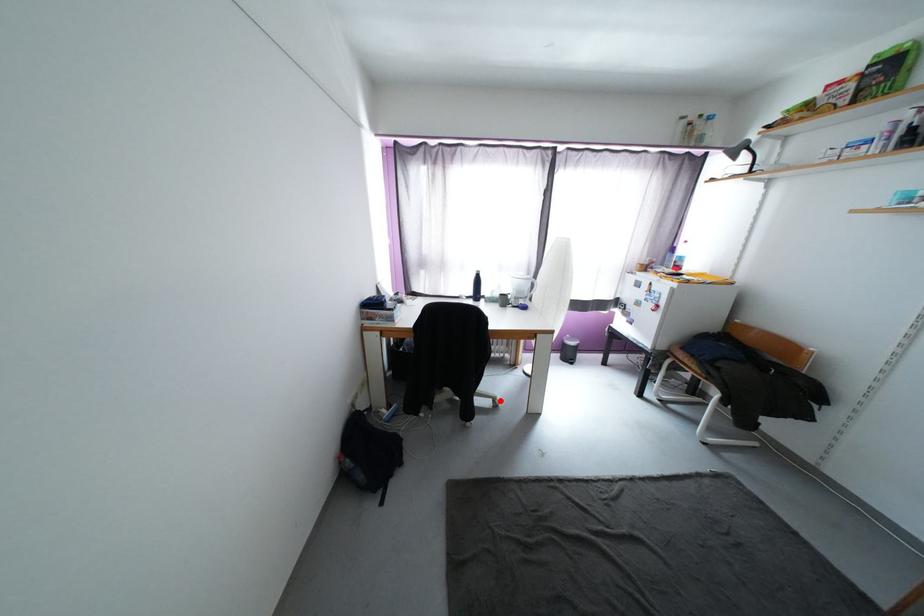
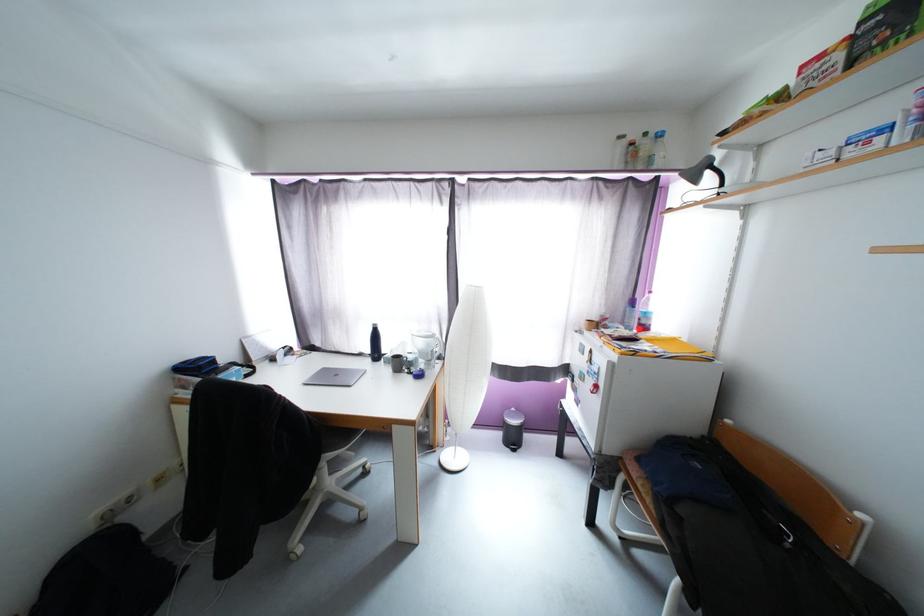
Question: I am providing you with two images of the same scene from different viewpoints. Given a red point in image1, look at the same physical point in image2. Is it:

Choices:
 (A) Closer to the viewpoint
 (B) Farther from the viewpoint

Answer: (A)